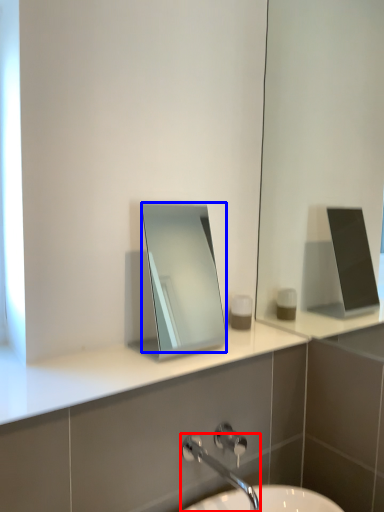
Question: Which of the following is the closest to the observer, tap (highlighted by a red box) or mirror (highlighted by a blue box)?

Choices:
 (A) tap
 (B) mirror

Answer: (A)